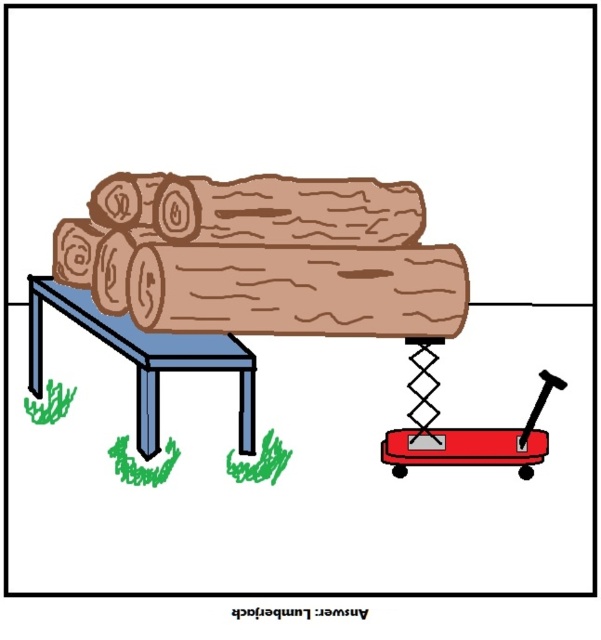
Does blue metal table at lower left appear on the right side of red plastic wagon at lower right?

No, blue metal table at lower left is not to the right of red plastic wagon at lower right.

Is point (188, 340) behind point (499, 458)?

Yes.

Between point (249, 394) and point (385, 435), which one is positioned in front?

Point (249, 394) is in front.

Where is `blue metal table at lower left`? blue metal table at lower left is located at coordinates (144, 356).